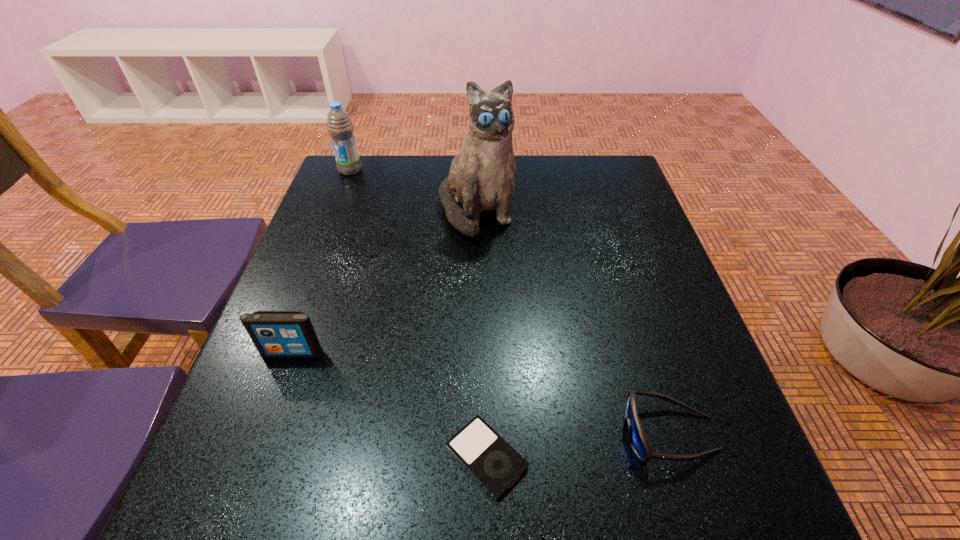
Locate an element on the screen. free space located at the face of the tallest object is located at coordinates (475, 381).

Locate an element on the screen. vacant space located 0.340m on the front of the farthest object is located at coordinates (318, 254).

This screenshot has width=960, height=540. I want to click on free space located 0.150m on the front screen of the third farthest object, so click(x=264, y=433).

Identify the location of vacant region located on the front-facing side of the sunglasses. (592, 433).

This screenshot has height=540, width=960. Find the location of `vacant region located 0.180m on the front-facing side of the sunglasses`. vacant region located 0.180m on the front-facing side of the sunglasses is located at coordinates (515, 433).

You are a GUI agent. You are given a task and a screenshot of the screen. Output one action in this format:
    pyautogui.click(x=<x>, y=<y>)
    Task: Click on the free region located on the front-facing side of the sunglasses
    This screenshot has width=960, height=540.
    Given the screenshot: What is the action you would take?
    pos(396,433)

Where is `vacant space located on the right of the right iPod`? This screenshot has height=540, width=960. vacant space located on the right of the right iPod is located at coordinates (577, 456).

This screenshot has height=540, width=960. In order to click on cat that is at the far edge in this screenshot , I will do `click(481, 178)`.

This screenshot has width=960, height=540. I want to click on water bottle at the far edge, so click(339, 125).

I want to click on object that is at the near edge, so click(x=489, y=458).